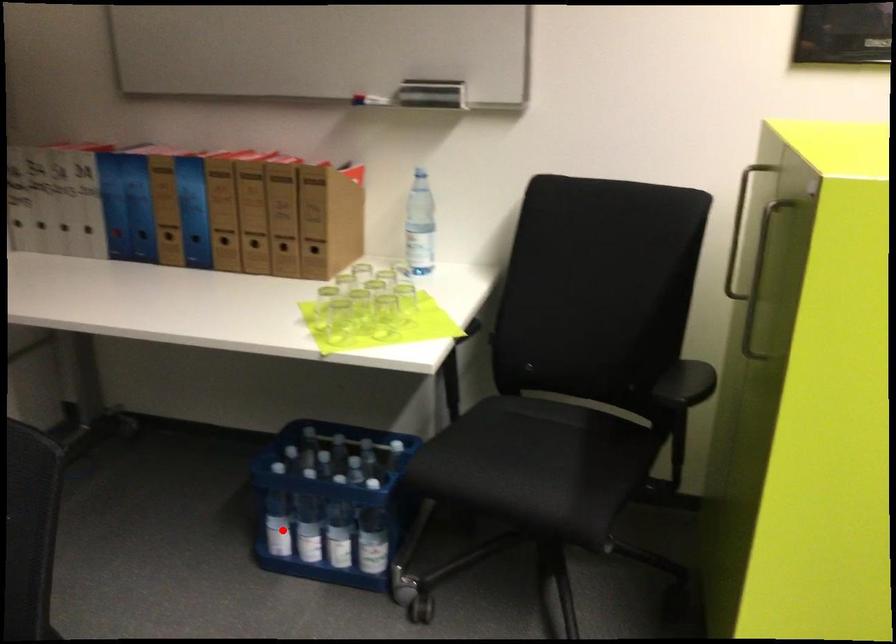
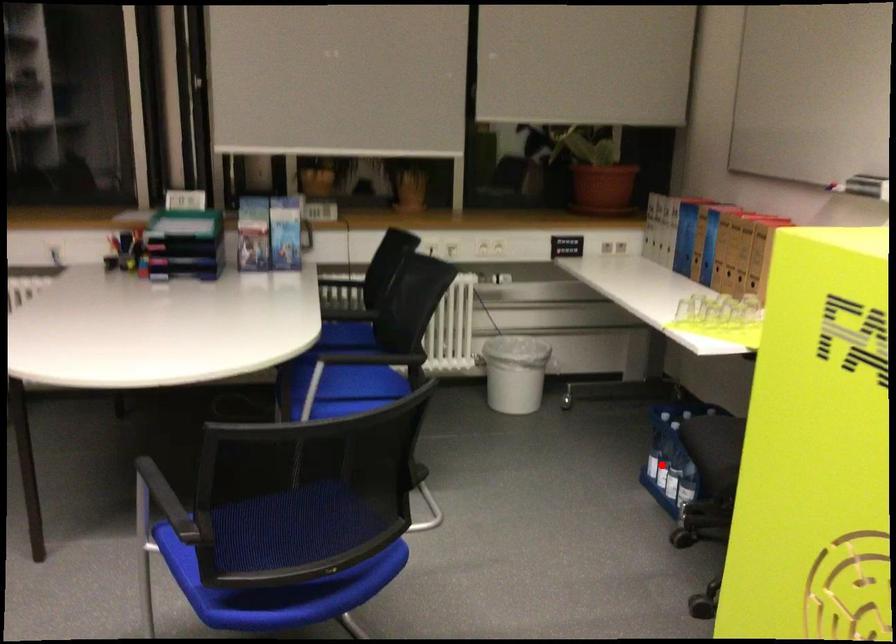
I am providing you with two images of the same scene from different viewpoints. A red point is marked on the first image and another point is marked on the second image. Do the highlighted points in image1 and image2 indicate the same real-world spot?

No